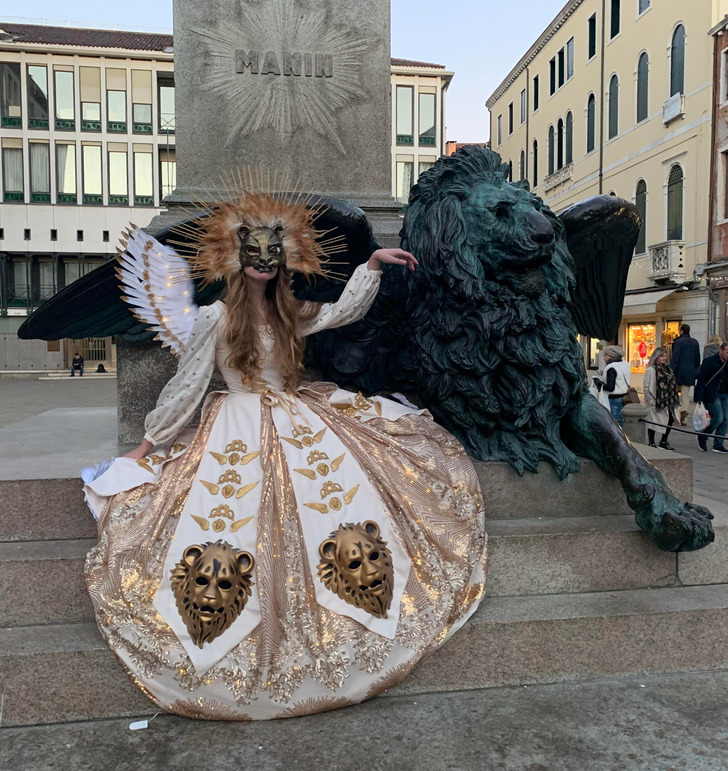
The height and width of the screenshot is (771, 728). Identify the location of light brown concrete stairs. (52, 648), (63, 537), (60, 470).